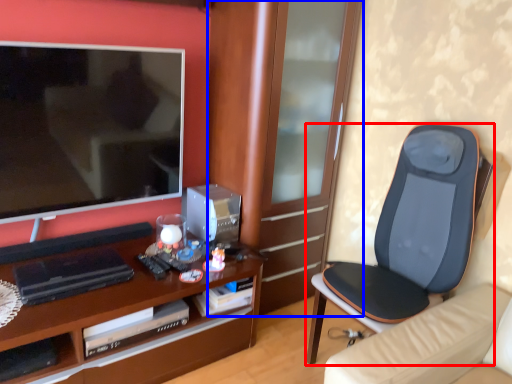
Question: Which point is further to the camera, chair (highlighted by a red box) or cabinetry (highlighted by a blue box)?

Choices:
 (A) chair
 (B) cabinetry

Answer: (B)